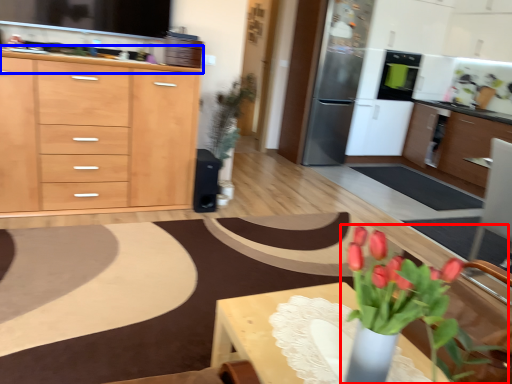
Question: Which object is closer to the camera taking this photo, houseplant (highlighted by a red box) or countertop (highlighted by a blue box)?

Choices:
 (A) houseplant
 (B) countertop

Answer: (A)